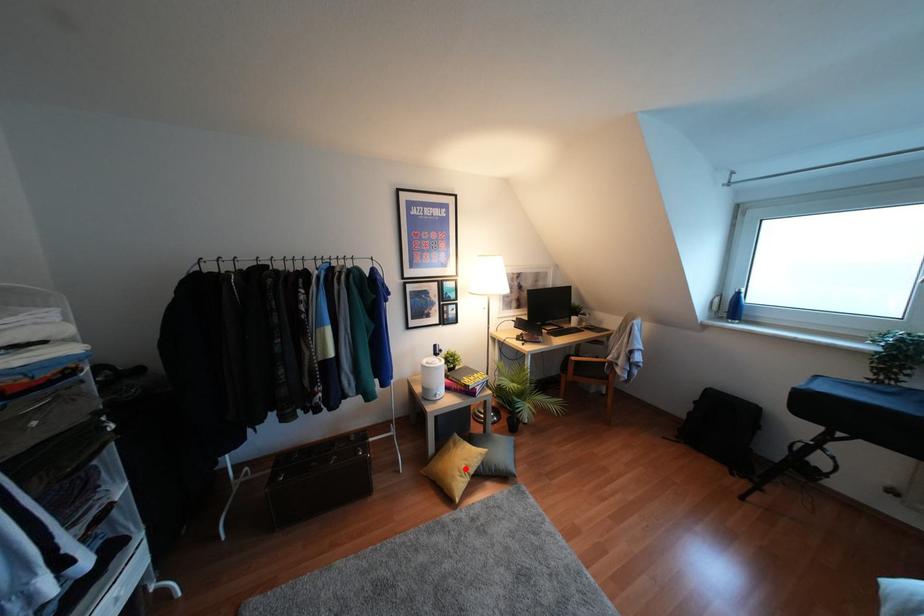
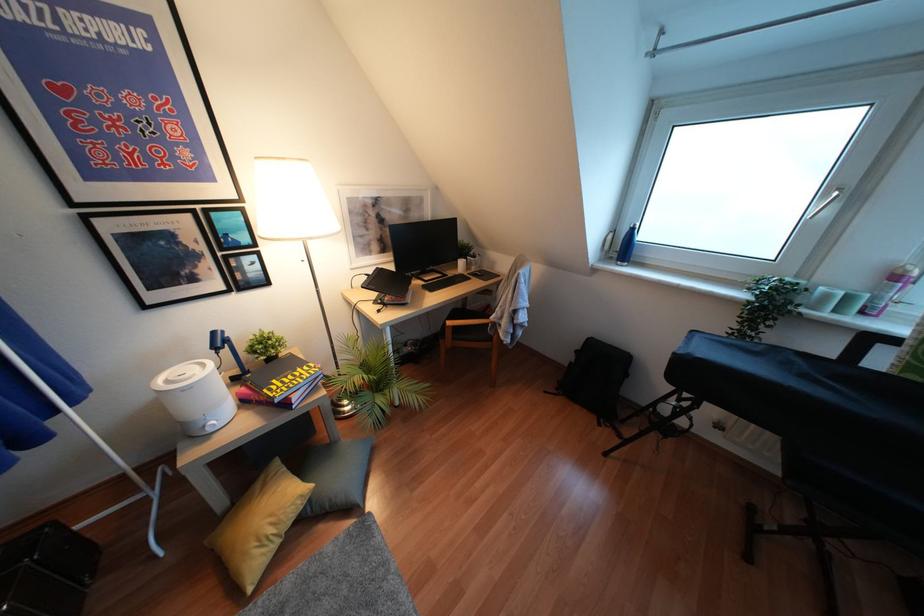
Question: I am providing you with two images of the same scene from different viewpoints. A red point is shown in image1. For the corresponding object point in image2, is it positioned nearer or farther from the camera?

Choices:
 (A) Nearer
 (B) Farther

Answer: (B)